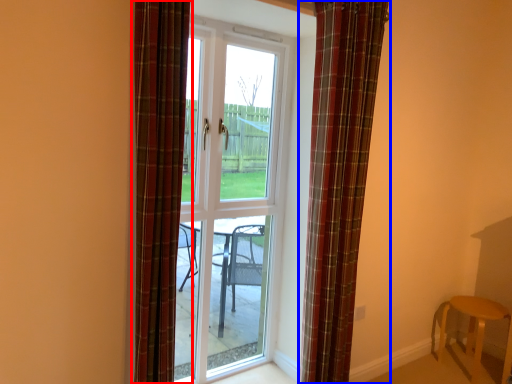
Question: Which point is further to the camera, curtain (highlighted by a red box) or curtain (highlighted by a blue box)?

Choices:
 (A) curtain
 (B) curtain

Answer: (B)